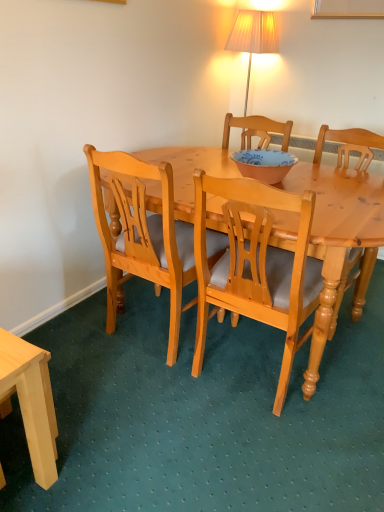
Question: Is light wood desk at lower left to the left of light wood chair at center, which is the 1th chair from right to left, from the viewer's perspective?

Choices:
 (A) yes
 (B) no

Answer: (A)

Question: Does light wood desk at lower left have a greater height compared to light wood chair at center, which is the 1th chair from right to left?

Choices:
 (A) yes
 (B) no

Answer: (B)

Question: Is the surface of light wood desk at lower left in direct contact with light wood chair at center, which is the 1th chair from right to left?

Choices:
 (A) yes
 (B) no

Answer: (B)

Question: Is light wood desk at lower left oriented away from light wood chair at center, which is counted as the 3th chair, starting from the left?

Choices:
 (A) yes
 (B) no

Answer: (B)

Question: From the image's perspective, does light wood desk at lower left appear higher than light wood chair at center, which is the 1th chair from right to left?

Choices:
 (A) yes
 (B) no

Answer: (B)

Question: From a real-world perspective, is light wood desk at lower left on top of light wood chair at center, which is counted as the 3th chair, starting from the left?

Choices:
 (A) no
 (B) yes

Answer: (A)

Question: Is matte pink bowl at center wider than light wood chair at center, the second chair in the right-to-left sequence?

Choices:
 (A) yes
 (B) no

Answer: (B)

Question: Considering the relative positions of matte pink bowl at center and light wood chair at center, the second chair in the right-to-left sequence, in the image provided, is matte pink bowl at center behind light wood chair at center, the second chair in the right-to-left sequence,?

Choices:
 (A) no
 (B) yes

Answer: (B)

Question: Does matte pink bowl at center appear on the right side of light wood chair at center, the second chair in the right-to-left sequence?

Choices:
 (A) yes
 (B) no

Answer: (A)

Question: Is matte pink bowl at center taller than light wood chair at center, the second chair in the right-to-left sequence?

Choices:
 (A) yes
 (B) no

Answer: (B)

Question: From the image's perspective, does matte pink bowl at center appear lower than light wood chair at center, the second chair in the right-to-left sequence?

Choices:
 (A) yes
 (B) no

Answer: (B)

Question: Is matte pink bowl at center looking in the opposite direction of light wood chair at center, which is counted as the second chair, starting from the left?

Choices:
 (A) no
 (B) yes

Answer: (A)

Question: From a real-world perspective, does light brown wood chair at center, the first chair from the left, stand above matte pink bowl at center?

Choices:
 (A) yes
 (B) no

Answer: (B)